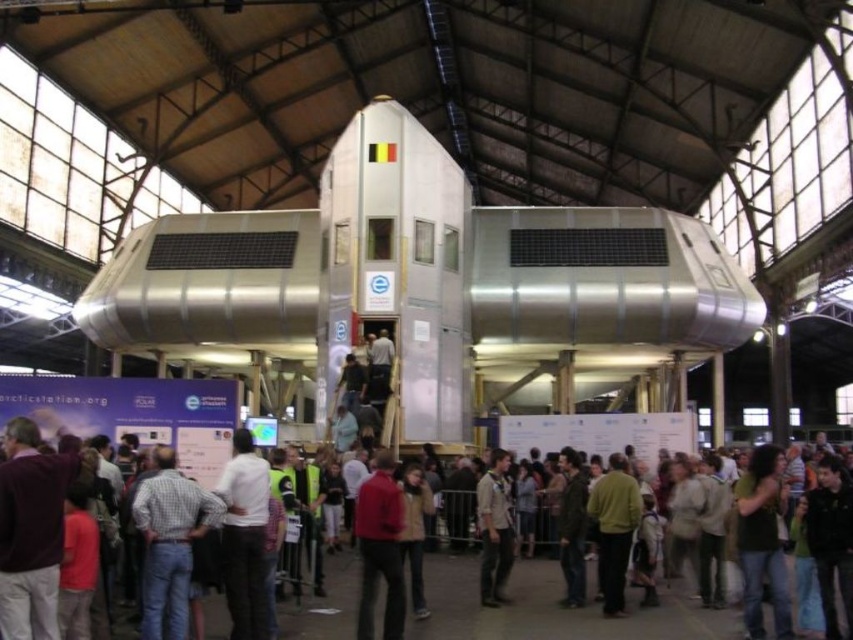
Question: Considering the relative positions of red sweater at center and light brown leather jacket at center in the image provided, where is red sweater at center located with respect to light brown leather jacket at center?

Choices:
 (A) right
 (B) left

Answer: (B)

Question: Does jeans at center have a lesser width compared to checkered shirt jeans at lower left?

Choices:
 (A) yes
 (B) no

Answer: (B)

Question: Which of the following is the farthest from the observer?

Choices:
 (A) maroon sweater at lower left
 (B) white matte shirt at center
 (C) red sweater at center

Answer: (C)

Question: Is checkered shirt jeans at lower left wider than white matte shirt at center?

Choices:
 (A) no
 (B) yes

Answer: (B)

Question: Considering the real-world distances, which object is farthest from the red sweater at center?

Choices:
 (A) white matte shirt at center
 (B) checkered shirt jeans at lower left
 (C) green sweater at center

Answer: (C)

Question: Considering the real-world distances, which object is closest to the jeans at center?

Choices:
 (A) white matte shirt at center
 (B) checkered shirt jeans at lower left
 (C) light brown leather jacket at center
 (D) maroon sweater at lower left

Answer: (C)